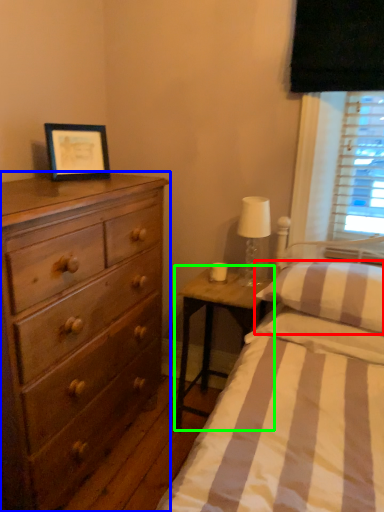
Question: Which object is positioned farthest from pillow (highlighted by a red box)? Select from chest of drawers (highlighted by a blue box) and nightstand (highlighted by a green box).

Choices:
 (A) chest of drawers
 (B) nightstand

Answer: (A)